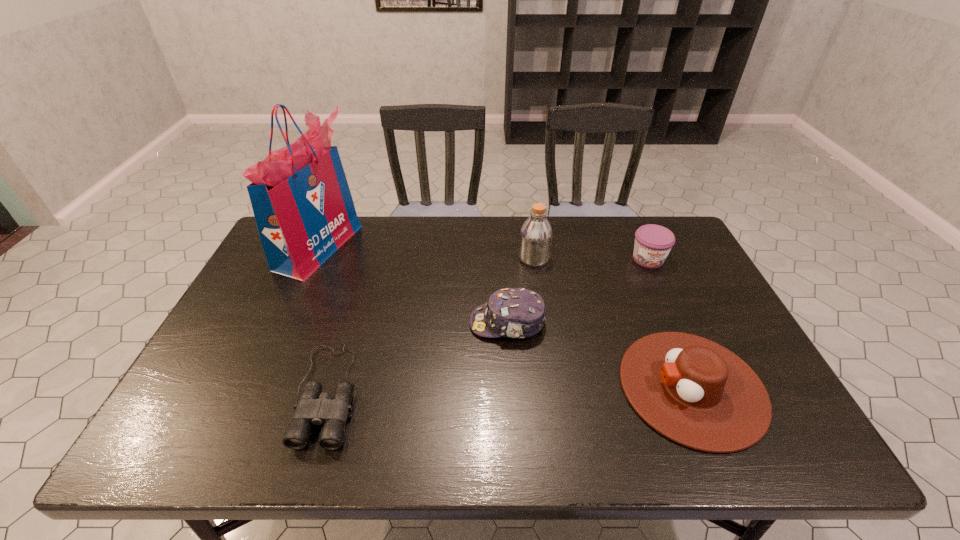
At what (x,y) coordinates should I click in order to perform the action: click on vacant area between the headwear and the grocery bag. Please return your answer as a coordinate pair (x, y). Image resolution: width=960 pixels, height=540 pixels. Looking at the image, I should click on (413, 285).

Where is `vacant space that's between the grocery bag and the headwear`? The width and height of the screenshot is (960, 540). vacant space that's between the grocery bag and the headwear is located at coordinates (413, 285).

The width and height of the screenshot is (960, 540). In order to click on free point between the cowboy hat and the headwear in this screenshot , I will do `click(600, 355)`.

This screenshot has width=960, height=540. What are the coordinates of `vacant area that lies between the jam and the bottle` in the screenshot? It's located at (591, 259).

I want to click on empty space that is in between the second tallest object and the jam, so click(x=591, y=259).

You are a GUI agent. You are given a task and a screenshot of the screen. Output one action in this format:
    pyautogui.click(x=<x>, y=<y>)
    Task: Click on the blank region between the jam and the headwear
    The width and height of the screenshot is (960, 540).
    Given the screenshot: What is the action you would take?
    pyautogui.click(x=578, y=291)

Locate an element on the screen. The image size is (960, 540). free space between the fifth shortest object and the binoculars is located at coordinates (431, 326).

What are the coordinates of `vacant area that lies between the headwear and the shortest object` in the screenshot? It's located at (418, 358).

Where is `object that stands as the second closest to the jam`? object that stands as the second closest to the jam is located at coordinates (697, 393).

The width and height of the screenshot is (960, 540). I want to click on object that can be found as the second closest to the tallest object, so click(519, 313).